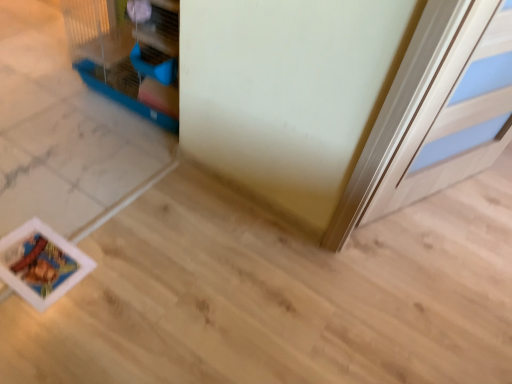
Question: In terms of width, does white glossy door at upper right look wider or thinner when compared to blue plastic bird cage at upper left?

Choices:
 (A) wide
 (B) thin

Answer: (B)

Question: Considering the positions of white glossy door at upper right and blue plastic bird cage at upper left in the image, is white glossy door at upper right taller or shorter than blue plastic bird cage at upper left?

Choices:
 (A) tall
 (B) short

Answer: (A)

Question: Would you say white glossy door at upper right is inside or outside blue plastic bird cage at upper left?

Choices:
 (A) outside
 (B) inside

Answer: (A)

Question: Considering the relative positions of blue plastic bird cage at upper left and white glossy door at upper right in the image provided, is blue plastic bird cage at upper left to the left or to the right of white glossy door at upper right?

Choices:
 (A) right
 (B) left

Answer: (B)

Question: Looking at their shapes, would you say blue plastic bird cage at upper left is wider or thinner than white glossy door at upper right?

Choices:
 (A) wide
 (B) thin

Answer: (A)

Question: Relative to white glossy door at upper right, is blue plastic bird cage at upper left in front or behind?

Choices:
 (A) behind
 (B) front

Answer: (A)

Question: From the image's perspective, is blue plastic bird cage at upper left located above or below white glossy door at upper right?

Choices:
 (A) below
 (B) above

Answer: (B)